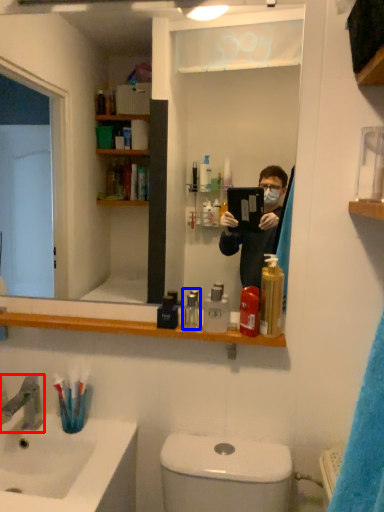
Question: Which point is closer to the camera, tap (highlighted by a red box) or mouthwash (highlighted by a blue box)?

Choices:
 (A) tap
 (B) mouthwash

Answer: (A)